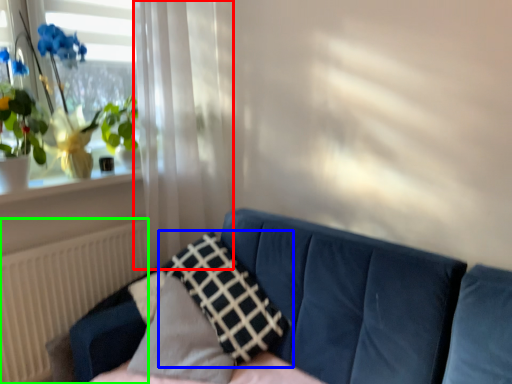
Question: Based on their relative distances, which object is farther from curtain (highlighted by a red box)? Choose from pillow (highlighted by a blue box) and radiator (highlighted by a green box).

Choices:
 (A) pillow
 (B) radiator

Answer: (A)